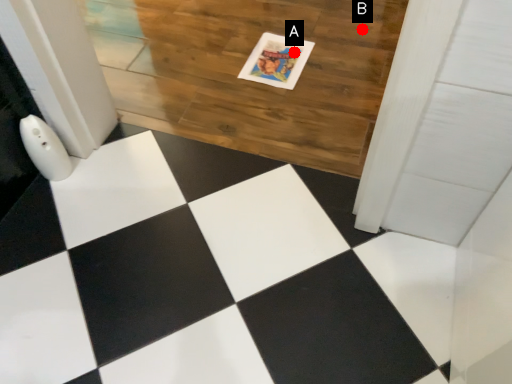
Question: Two points are circled on the image, labeled by A and B beside each circle. Which point is closer to the camera?

Choices:
 (A) A is closer
 (B) B is closer

Answer: (A)